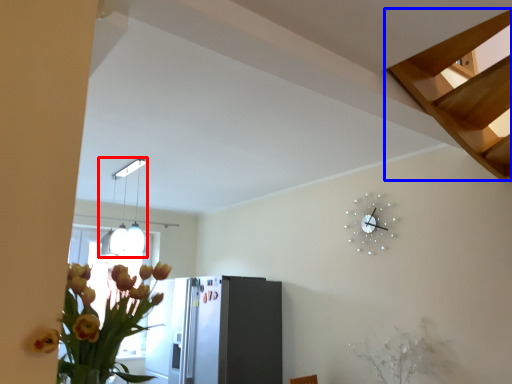
Question: Which point is further to the camera, lamp (highlighted by a red box) or stairs (highlighted by a blue box)?

Choices:
 (A) lamp
 (B) stairs

Answer: (A)